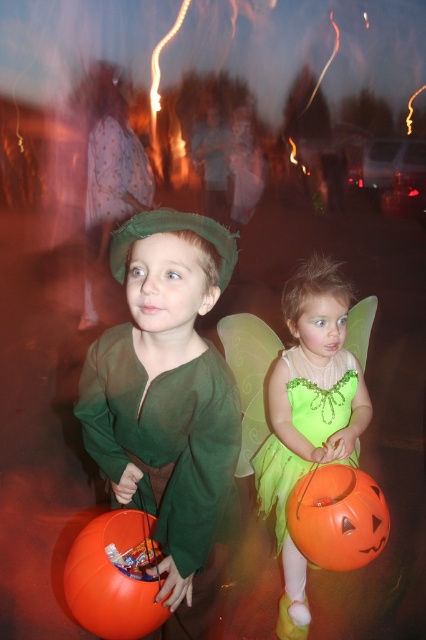
Is green matte costume at center taller than green tulle dress at lower right?

No, green matte costume at center is not taller than green tulle dress at lower right.

Does green matte costume at center have a lesser width compared to green tulle dress at lower right?

Yes, green matte costume at center is thinner than green tulle dress at lower right.

Between point (187, 518) and point (356, 403), which one is positioned behind?

Positioned behind is point (356, 403).

You are a GUI agent. You are given a task and a screenshot of the screen. Output one action in this format:
    pyautogui.click(x=<x>, y=<y>)
    Task: Click on the green matte costume at center
    The image size is (426, 640).
    Given the screenshot: What is the action you would take?
    169,403

Which of these two, green matte costume at center or orange matte pumpkin at lower left, stands shorter?

orange matte pumpkin at lower left

Is green matte costume at center positioned before orange matte pumpkin at lower left?

That is True.

The width and height of the screenshot is (426, 640). What are the coordinates of `green matte costume at center` in the screenshot? It's located at (169, 403).

Can you confirm if green matte costume at center is wider than lime green tulle dress at lower center?

Indeed, green matte costume at center has a greater width compared to lime green tulle dress at lower center.

Between point (192, 236) and point (261, 470), which one is positioned in front?

Point (192, 236)

The width and height of the screenshot is (426, 640). Find the location of `green matte costume at center`. green matte costume at center is located at coordinates (169, 403).